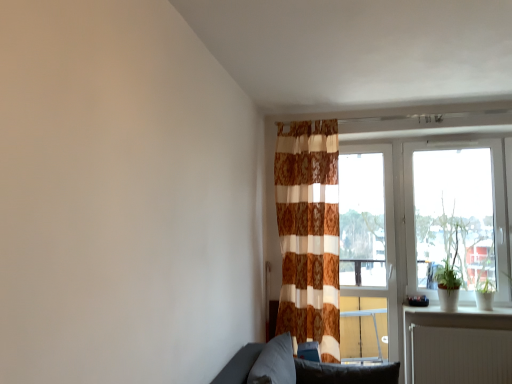
Question: From a real-world perspective, is dark gray fabric pillow at lower center, the first pillow positioned from the left, located higher than white glossy window sill at lower right?

Choices:
 (A) yes
 (B) no

Answer: (B)

Question: Considering the relative sizes of dark gray fabric pillow at lower center, the first pillow positioned from the left, and white glossy window sill at lower right in the image provided, is dark gray fabric pillow at lower center, the first pillow positioned from the left, shorter than white glossy window sill at lower right?

Choices:
 (A) no
 (B) yes

Answer: (A)

Question: Would you say white glossy window sill at lower right is part of dark gray fabric pillow at lower center, which appears as the 2th pillow when viewed from the right,'s contents?

Choices:
 (A) no
 (B) yes

Answer: (A)

Question: Could you tell me if dark gray fabric pillow at lower center, which appears as the 2th pillow when viewed from the right, is facing white glossy window sill at lower right?

Choices:
 (A) yes
 (B) no

Answer: (B)

Question: Considering the relative sizes of dark gray fabric pillow at lower center, the first pillow positioned from the left, and white glossy window sill at lower right in the image provided, is dark gray fabric pillow at lower center, the first pillow positioned from the left, wider than white glossy window sill at lower right?

Choices:
 (A) no
 (B) yes

Answer: (A)

Question: Visually, is white ribbed radiator at lower right positioned to the left or to the right of transparent glass window at right?

Choices:
 (A) left
 (B) right

Answer: (A)

Question: Is white ribbed radiator at lower right taller or shorter than transparent glass window at right?

Choices:
 (A) short
 (B) tall

Answer: (A)

Question: From a real-world perspective, is white ribbed radiator at lower right above or below transparent glass window at right?

Choices:
 (A) below
 (B) above

Answer: (A)

Question: Considering the positions of point (459, 370) and point (425, 256), is point (459, 370) closer or farther from the camera than point (425, 256)?

Choices:
 (A) farther
 (B) closer

Answer: (B)

Question: In the image, is transparent glass window at right positioned in front of or behind soft gray cushion at lower center, which ranks as the second pillow in left-to-right order?

Choices:
 (A) front
 (B) behind

Answer: (B)

Question: Considering the positions of transparent glass window at right and soft gray cushion at lower center, which ranks as the second pillow in left-to-right order, in the image, is transparent glass window at right taller or shorter than soft gray cushion at lower center, which ranks as the second pillow in left-to-right order,?

Choices:
 (A) tall
 (B) short

Answer: (A)

Question: Considering the positions of transparent glass window at right and soft gray cushion at lower center, which ranks as the second pillow in left-to-right order, in the image, is transparent glass window at right bigger or smaller than soft gray cushion at lower center, which ranks as the second pillow in left-to-right order,?

Choices:
 (A) big
 (B) small

Answer: (A)

Question: Looking at their shapes, would you say transparent glass window at right is wider or thinner than soft gray cushion at lower center, which ranks as the second pillow in left-to-right order?

Choices:
 (A) thin
 (B) wide

Answer: (B)

Question: Considering the positions of brown textured curtain at center and green matte plant at right in the image, is brown textured curtain at center wider or thinner than green matte plant at right?

Choices:
 (A) thin
 (B) wide

Answer: (B)

Question: From the image's perspective, is brown textured curtain at center located above or below green matte plant at right?

Choices:
 (A) above
 (B) below

Answer: (A)